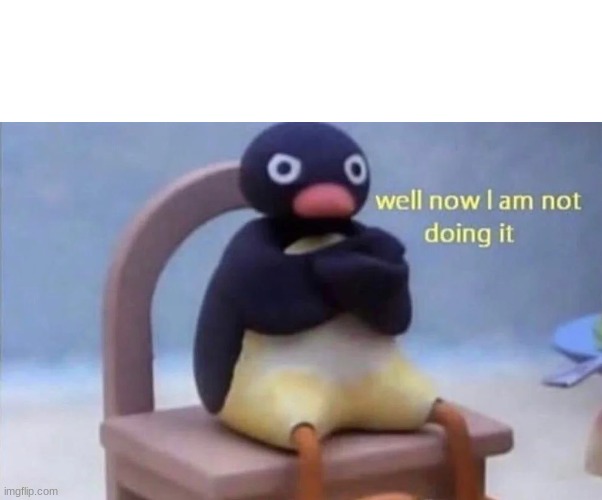
Where is `seat of chair`? seat of chair is located at coordinates (190, 455).